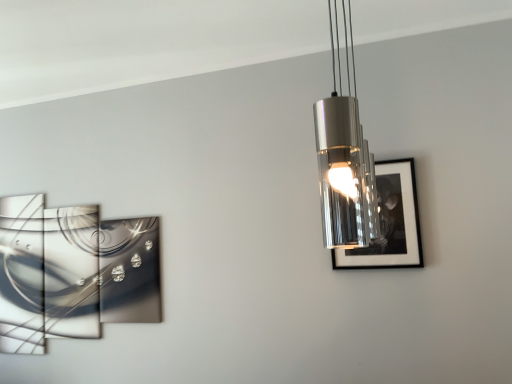
Question: From a real-world perspective, is metallic reflective artwork at left, which is the first picture frame from left to right, positioned over black glossy picture frame at right, acting as the 1th picture frame starting from the front, based on gravity?

Choices:
 (A) yes
 (B) no

Answer: (B)

Question: Is metallic reflective artwork at left, placed as the 1th picture frame when sorted from back to front, turned away from black glossy picture frame at right, positioned as the second picture frame in back-to-front order?

Choices:
 (A) yes
 (B) no

Answer: (B)

Question: Is metallic reflective artwork at left, the second picture frame when ordered from front to back, positioned behind black glossy picture frame at right, positioned as the first picture frame in right-to-left order?

Choices:
 (A) yes
 (B) no

Answer: (A)

Question: Can you confirm if metallic reflective artwork at left, placed as the 1th picture frame when sorted from back to front, is smaller than black glossy picture frame at right, positioned as the second picture frame in back-to-front order?

Choices:
 (A) no
 (B) yes

Answer: (A)

Question: Is metallic reflective artwork at left, the second picture frame positioned from the right, bigger than black glossy picture frame at right, positioned as the first picture frame in right-to-left order?

Choices:
 (A) no
 (B) yes

Answer: (B)

Question: Can you confirm if metallic reflective artwork at left, which is the first picture frame from left to right, is taller than black glossy picture frame at right, marked as the second picture frame in a left-to-right arrangement?

Choices:
 (A) yes
 (B) no

Answer: (A)

Question: From a real-world perspective, is metallic cylindrical light fixture at upper center over black glossy picture frame at right, acting as the 1th picture frame starting from the front?

Choices:
 (A) no
 (B) yes

Answer: (B)

Question: Can you confirm if metallic cylindrical light fixture at upper center is taller than black glossy picture frame at right, acting as the 1th picture frame starting from the front?

Choices:
 (A) no
 (B) yes

Answer: (B)

Question: Is metallic cylindrical light fixture at upper center to the right of black glossy picture frame at right, acting as the 1th picture frame starting from the front, from the viewer's perspective?

Choices:
 (A) yes
 (B) no

Answer: (B)

Question: From the image's perspective, is metallic cylindrical light fixture at upper center below black glossy picture frame at right, marked as the second picture frame in a left-to-right arrangement?

Choices:
 (A) yes
 (B) no

Answer: (B)

Question: Is metallic cylindrical light fixture at upper center positioned far away from black glossy picture frame at right, marked as the second picture frame in a left-to-right arrangement?

Choices:
 (A) no
 (B) yes

Answer: (A)

Question: Considering the relative sizes of metallic cylindrical light fixture at upper center and black glossy picture frame at right, marked as the second picture frame in a left-to-right arrangement, in the image provided, is metallic cylindrical light fixture at upper center thinner than black glossy picture frame at right, marked as the second picture frame in a left-to-right arrangement,?

Choices:
 (A) no
 (B) yes

Answer: (A)

Question: Is black glossy picture frame at right, positioned as the first picture frame in right-to-left order, positioned beyond the bounds of metallic cylindrical light fixture at upper center?

Choices:
 (A) yes
 (B) no

Answer: (A)